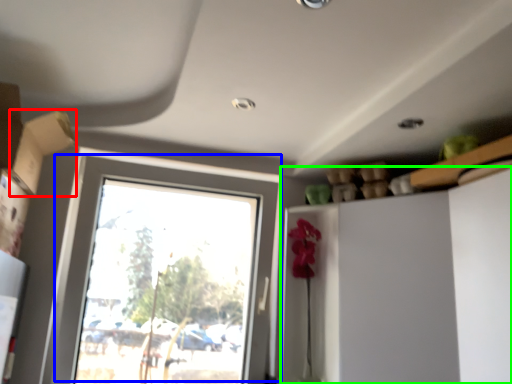
Question: Estimate the real-world distances between objects in this image. Which object is closer to cardboard box (highlighted by a red box), window (highlighted by a blue box) or dresser (highlighted by a green box)?

Choices:
 (A) window
 (B) dresser

Answer: (A)